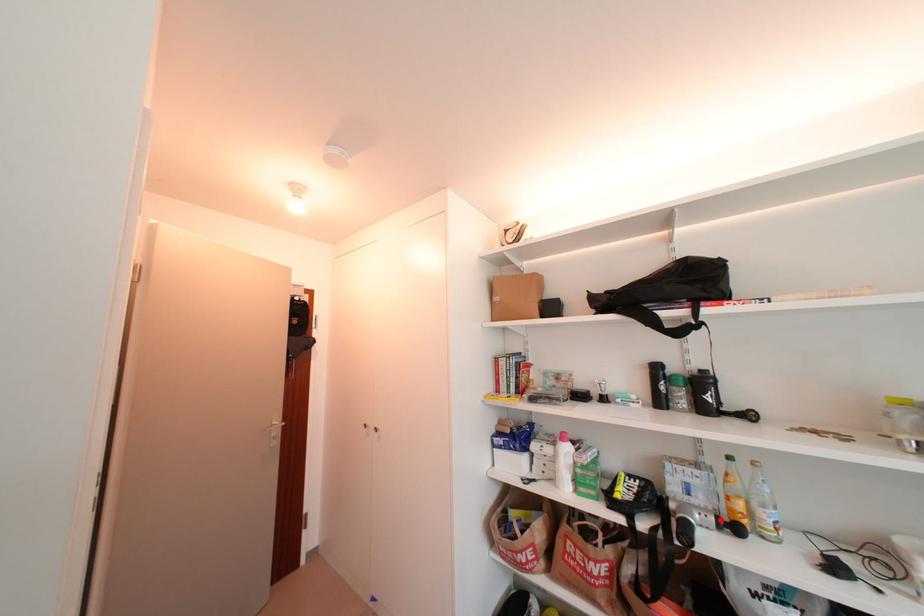
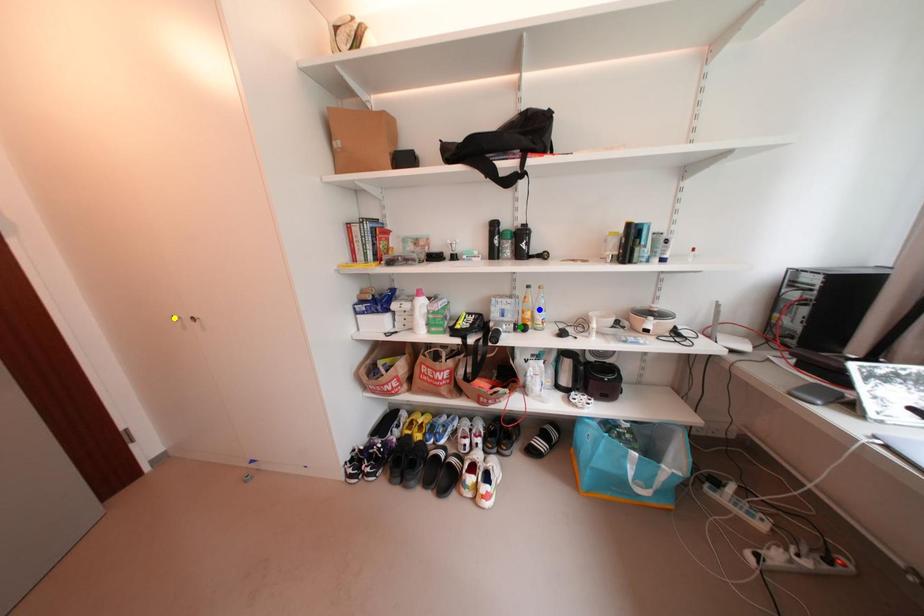
Question: I am providing you with two images of the same scene from different viewpoints. A red point is marked on the first image. You are given multiple points on the second image. Which point in image 2 is actually the same real-world point as the red point in image 1?

Choices:
 (A) blue point
 (B) green point
 (C) yellow point

Answer: (B)